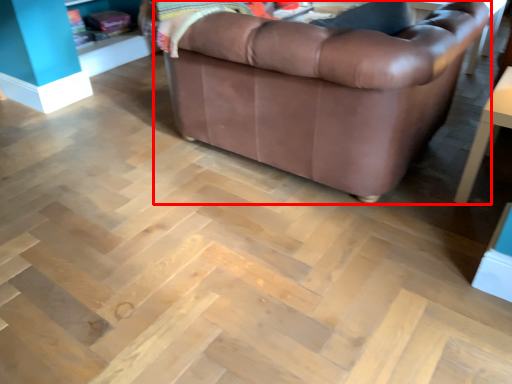
Question: Observing the image, what is the correct spatial positioning of studio couch (annotated by the red box) in reference to table?

Choices:
 (A) left
 (B) right

Answer: (A)